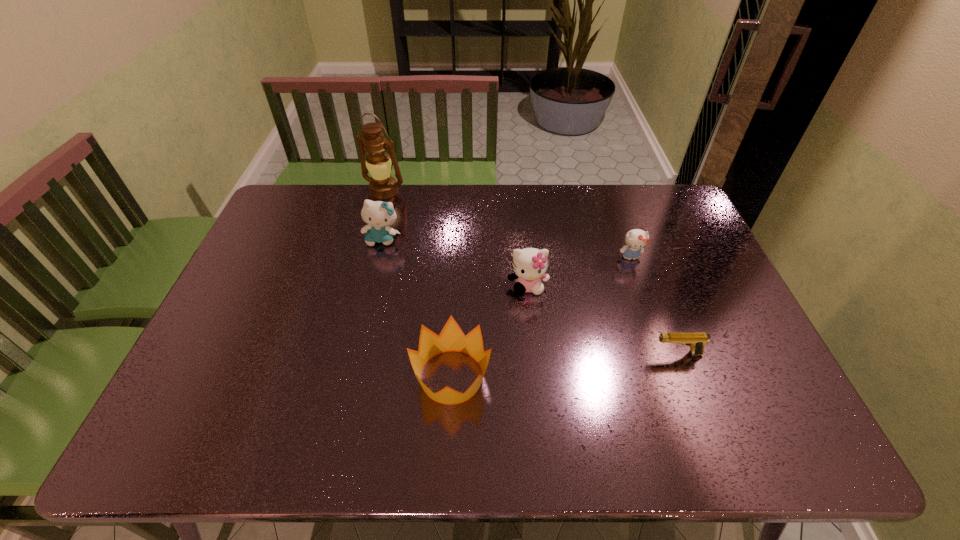
In order to click on vacant space located on the front of the farthest object in this screenshot , I will do `click(372, 244)`.

I want to click on blank area located on the face of the leftmost kitten, so click(x=365, y=314).

In order to click on free region located 0.370m on the front-facing side of the third object from right to left in this screenshot , I will do `click(541, 419)`.

You are a GUI agent. You are given a task and a screenshot of the screen. Output one action in this format:
    pyautogui.click(x=<x>, y=<y>)
    Task: Click on the free spot located 0.390m on the right of the crown
    
    Given the screenshot: What is the action you would take?
    pyautogui.click(x=649, y=377)

This screenshot has height=540, width=960. I want to click on blank area located 0.130m on the front-facing side of the third farthest object, so click(x=643, y=296).

In order to click on blank area located at the barrel of the pistol in this screenshot , I will do `click(555, 354)`.

At what (x,y) coordinates should I click in order to perform the action: click on vacant area situated at the barrel of the pistol. Please return your answer as a coordinate pair (x, y). The height and width of the screenshot is (540, 960). Looking at the image, I should click on (543, 354).

This screenshot has height=540, width=960. Identify the location of free point located 0.130m at the barrel of the pistol. (602, 354).

The width and height of the screenshot is (960, 540). I want to click on object that is positioned at the far edge, so click(382, 186).

Where is `object at the right edge`? object at the right edge is located at coordinates (696, 340).